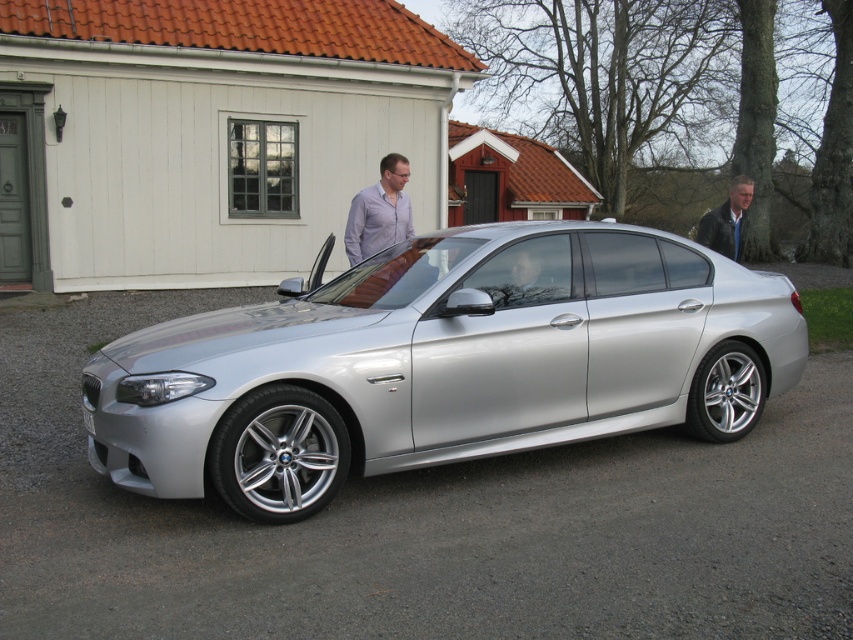
You are a delivery person holding a package and you see the silver metallic car at center and the matte white shirt at center. Which object is closer to you?

The silver metallic car at center is closer to you because it is only 6.87 feet away from the matte white shirt at center, but without knowing your exact position, we can only state the distance between them is 6.87 feet.

You are standing at the point closer to the main house in the image. Which point are you at? The options are point A at coordinates point A is point (381,413) and point B is point (410,224). Please choose between point A or point B.

Point A at coordinates (381,413) is in front of point B at coordinates (410,224). Since you are standing at the point closer to the main house, you would be at point A.